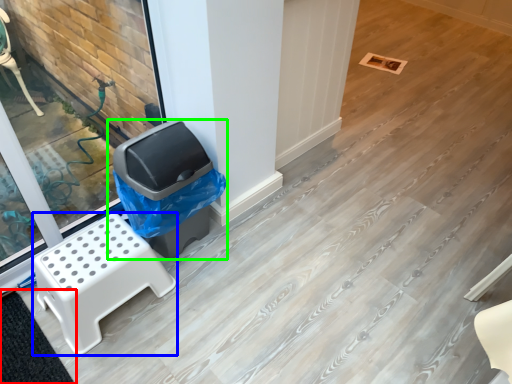
Question: Considering the real-world distances, which object is closest to mat (highlighted by a red box)? furniture (highlighted by a blue box) or waste container (highlighted by a green box).

Choices:
 (A) furniture
 (B) waste container

Answer: (A)